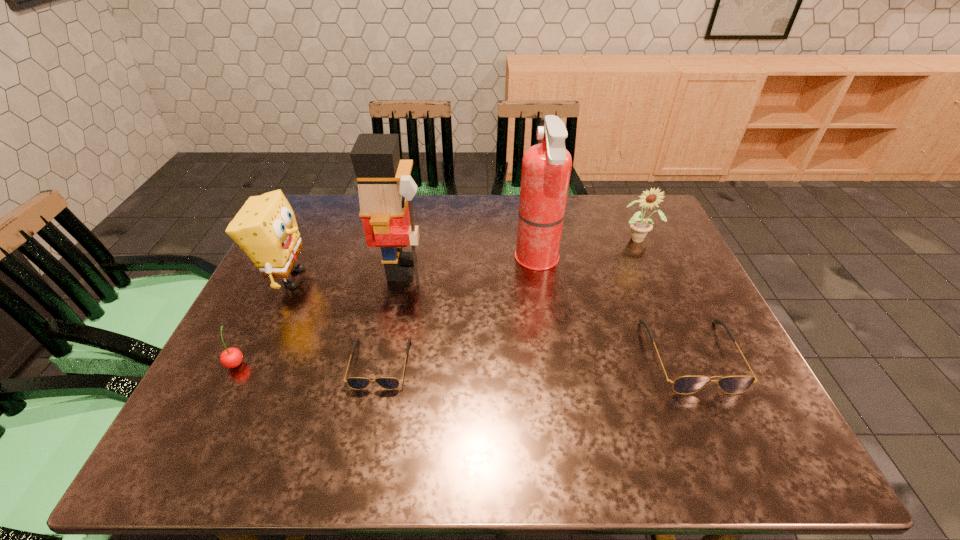
Point out which object is positioned as the nearest to the second shortest object. Please provide its 2D coordinates. Your answer should be formatted as a tuple, i.e. [(x, y)], where the tuple contains the x and y coordinates of a point satisfying the conditions above.

[(546, 167)]